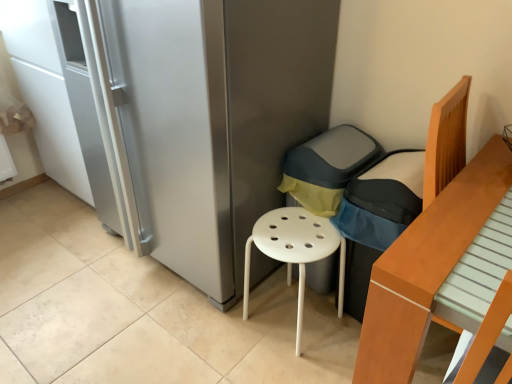
Question: Is light brown wooden bed at right to the right of white plastic stool at center from the viewer's perspective?

Choices:
 (A) yes
 (B) no

Answer: (A)

Question: Does light brown wooden bed at right turn towards white plastic stool at center?

Choices:
 (A) yes
 (B) no

Answer: (B)

Question: From the image's perspective, is light brown wooden bed at right located above white plastic stool at center?

Choices:
 (A) yes
 (B) no

Answer: (B)

Question: Is light brown wooden bed at right thinner than white plastic stool at center?

Choices:
 (A) no
 (B) yes

Answer: (A)

Question: From a real-world perspective, is light brown wooden bed at right on white plastic stool at center?

Choices:
 (A) no
 (B) yes

Answer: (B)

Question: Is white plastic stool at center located within light brown wooden bed at right?

Choices:
 (A) yes
 (B) no

Answer: (B)

Question: Does white plastic stool at center lie in front of light brown wooden bed at right?

Choices:
 (A) yes
 (B) no

Answer: (B)

Question: Does white plastic stool at center have a larger size compared to light brown wooden bed at right?

Choices:
 (A) yes
 (B) no

Answer: (B)

Question: Is white plastic stool at center located outside light brown wooden bed at right?

Choices:
 (A) no
 (B) yes

Answer: (B)

Question: From the image's perspective, is white plastic stool at center beneath light brown wooden bed at right?

Choices:
 (A) no
 (B) yes

Answer: (A)

Question: From a real-world perspective, is white plastic stool at center located beneath light brown wooden bed at right?

Choices:
 (A) no
 (B) yes

Answer: (B)

Question: Can you confirm if white plastic stool at center is taller than light brown wooden bed at right?

Choices:
 (A) no
 (B) yes

Answer: (A)

Question: From the image's perspective, would you say dark gray fabric armchair at center is shown under light brown wooden bed at right?

Choices:
 (A) yes
 (B) no

Answer: (B)